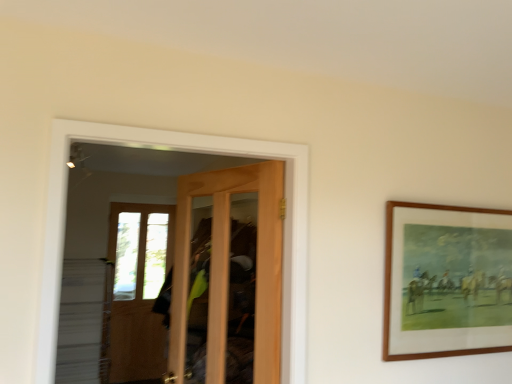
Question: Based on their sizes in the image, would you say light brown wooden door at center is bigger or smaller than wooden framed painting at upper right?

Choices:
 (A) big
 (B) small

Answer: (A)

Question: From the image's perspective, is light brown wooden door at center located above or below wooden framed painting at upper right?

Choices:
 (A) above
 (B) below

Answer: (B)

Question: In terms of width, does light brown wooden door at center look wider or thinner when compared to wooden framed painting at upper right?

Choices:
 (A) thin
 (B) wide

Answer: (B)

Question: Is wooden framed painting at upper right inside or outside of light brown wooden door at center?

Choices:
 (A) inside
 (B) outside

Answer: (B)

Question: Is point (499, 316) positioned closer to the camera than point (224, 359)?

Choices:
 (A) farther
 (B) closer

Answer: (B)

Question: Looking at the image, does wooden framed painting at upper right seem bigger or smaller compared to light brown wooden door at center?

Choices:
 (A) big
 (B) small

Answer: (B)

Question: From the image's perspective, is wooden framed painting at upper right positioned above or below light brown wooden door at center?

Choices:
 (A) below
 (B) above

Answer: (B)